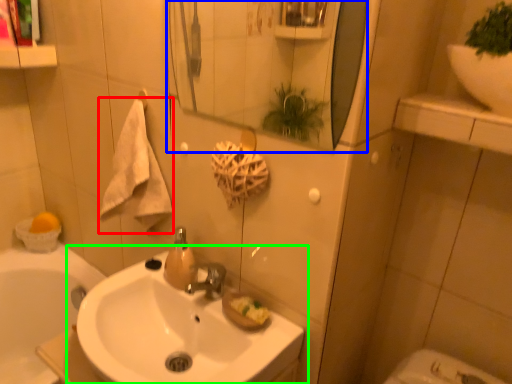
Question: Which object is positioned closest to bath towel (highlighted by a red box)? Select from mirror (highlighted by a blue box) and sink (highlighted by a green box).

Choices:
 (A) mirror
 (B) sink

Answer: (B)